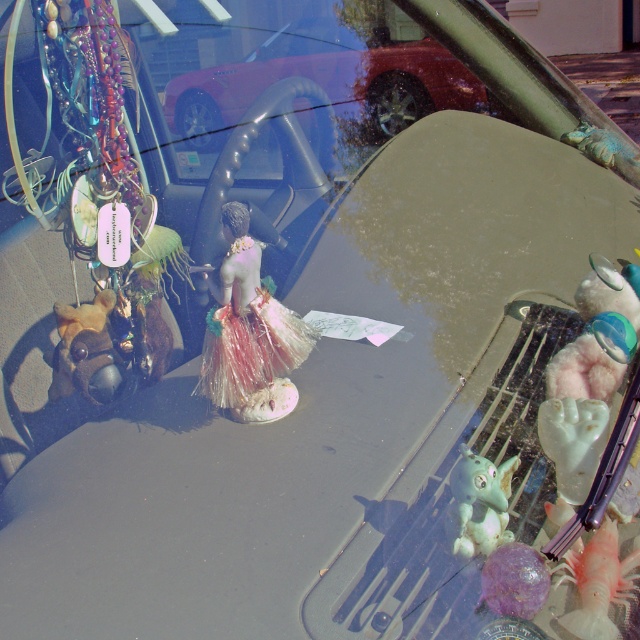
From the picture: You are a passenger in a car and notice two items hanging from the windshield. The items are the metallic red car at center and the shiny metallic figurine at center. Which one is located to the right of the other?

The metallic red car at center is positioned on the right side of the shiny metallic figurine at center.